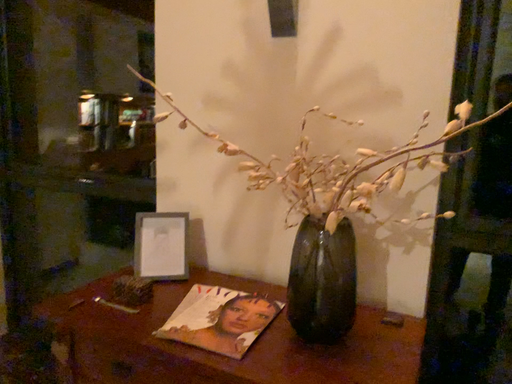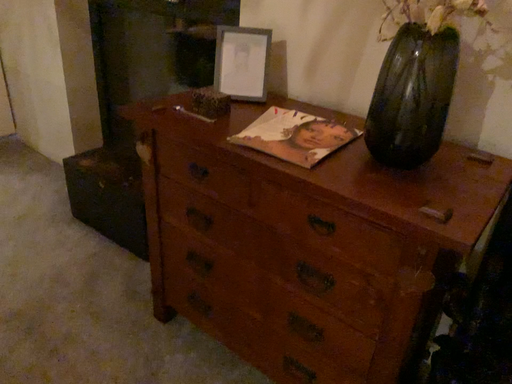
Question: How did the camera likely rotate when shooting the video?

Choices:
 (A) rotated downward
 (B) rotated upward

Answer: (A)